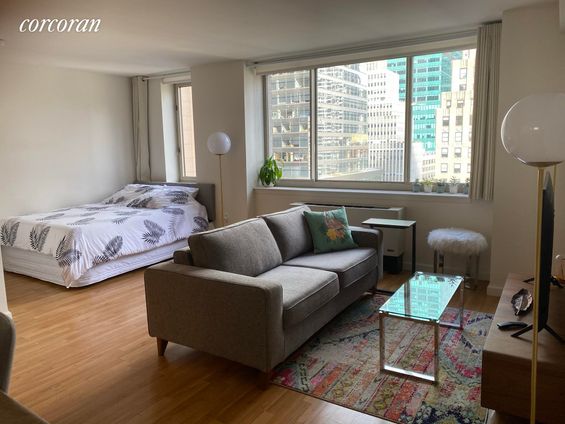
Identify the location of radiator. (355, 219).